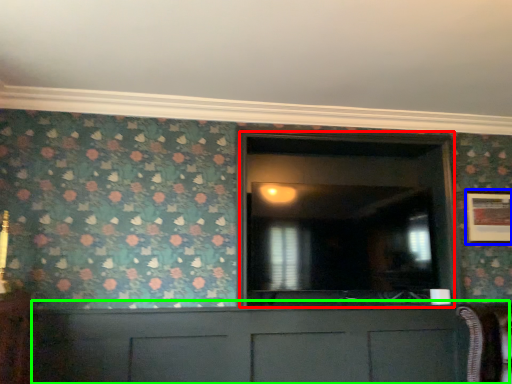
Question: Considering the real-world distances, which object is closest to glass door (highlighted by a red box)? picture frame (highlighted by a blue box) or cabinetry (highlighted by a green box).

Choices:
 (A) picture frame
 (B) cabinetry

Answer: (B)